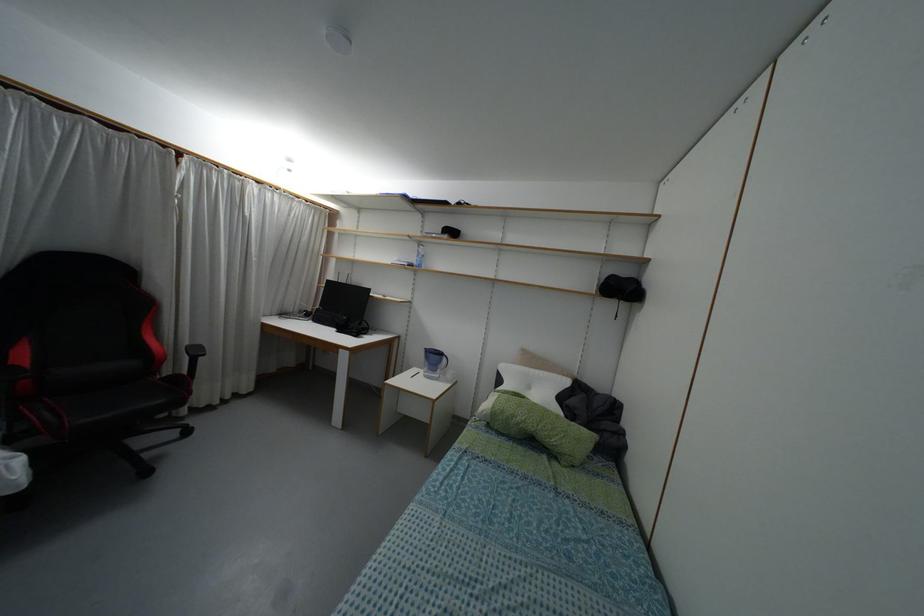
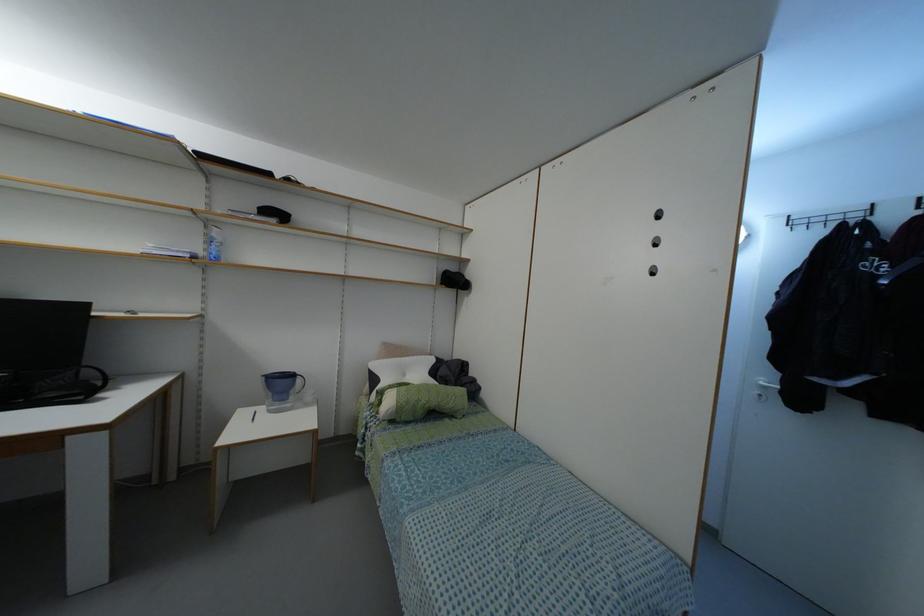
Question: The first image is from the beginning of the video and the second image is from the end. How did the camera likely rotate when shooting the video?

Choices:
 (A) Left
 (B) Right
 (C) Up
 (D) Down

Answer: (B)